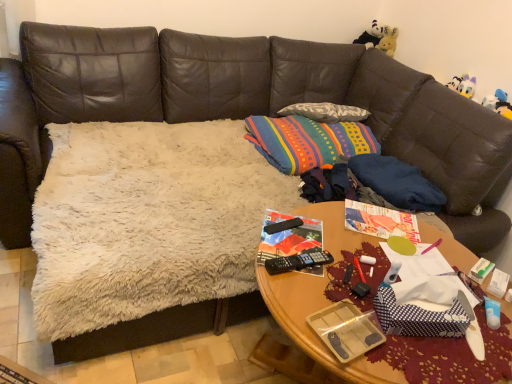
The height and width of the screenshot is (384, 512). Find the location of `vacant space underneath clear plastic tray at center (from a real-world perspective)`. vacant space underneath clear plastic tray at center (from a real-world perspective) is located at coordinates (338, 337).